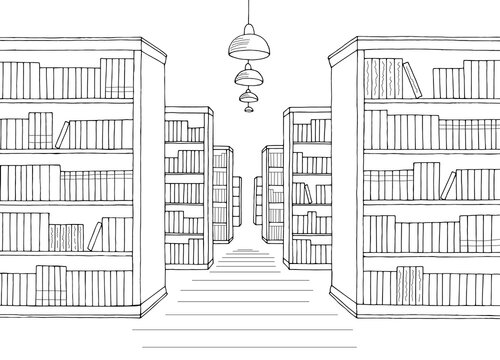
This screenshot has height=360, width=500. I want to click on bookcases, so click(x=72, y=47), click(x=179, y=108), click(x=215, y=147), click(x=234, y=177), click(x=256, y=177), click(x=274, y=146), click(x=312, y=108), click(x=430, y=45).